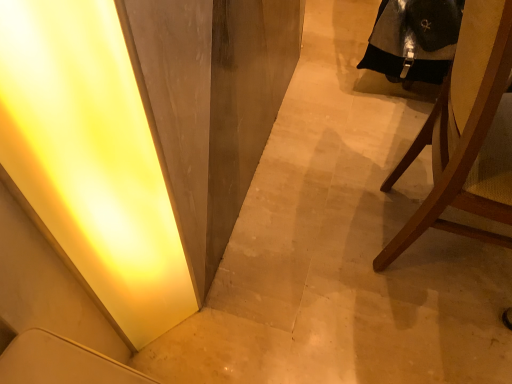
Question: Is black leather robe at upper right completely or partially inside matte yellow light at lower left?

Choices:
 (A) yes
 (B) no

Answer: (B)

Question: Does matte yellow light at lower left turn towards black leather robe at upper right?

Choices:
 (A) no
 (B) yes

Answer: (A)

Question: From a real-world perspective, is matte yellow light at lower left on top of black leather robe at upper right?

Choices:
 (A) yes
 (B) no

Answer: (A)

Question: Is black leather robe at upper right at the back of matte yellow light at lower left?

Choices:
 (A) no
 (B) yes

Answer: (A)

Question: Is matte yellow light at lower left completely or partially outside of black leather robe at upper right?

Choices:
 (A) no
 (B) yes

Answer: (B)

Question: From a real-world perspective, is matte yellow light at lower left under black leather robe at upper right?

Choices:
 (A) no
 (B) yes

Answer: (A)

Question: Are brown wooden chair at right and black leather robe at upper right located far from each other?

Choices:
 (A) no
 (B) yes

Answer: (A)

Question: Is brown wooden chair at right in contact with black leather robe at upper right?

Choices:
 (A) no
 (B) yes

Answer: (A)

Question: Is brown wooden chair at right at the right side of black leather robe at upper right?

Choices:
 (A) no
 (B) yes

Answer: (B)

Question: Is brown wooden chair at right outside black leather robe at upper right?

Choices:
 (A) yes
 (B) no

Answer: (A)

Question: Considering the relative positions of brown wooden chair at right and black leather robe at upper right in the image provided, is brown wooden chair at right to the left of black leather robe at upper right from the viewer's perspective?

Choices:
 (A) yes
 (B) no

Answer: (B)

Question: Can you confirm if brown wooden chair at right is wider than black leather robe at upper right?

Choices:
 (A) no
 (B) yes

Answer: (B)

Question: Can you see black leather robe at upper right touching brown wooden chair at right?

Choices:
 (A) yes
 (B) no

Answer: (B)